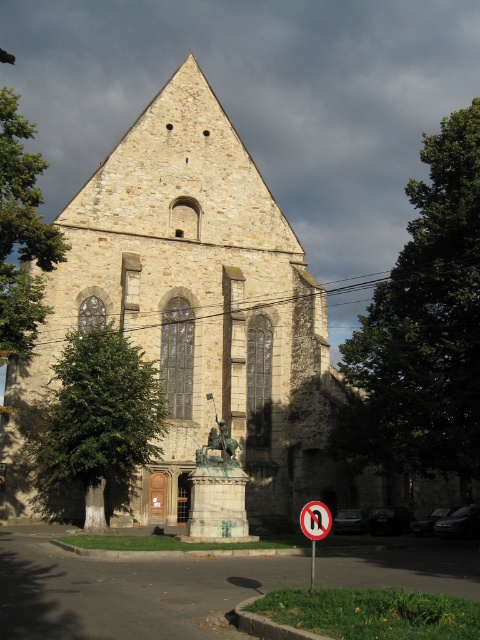
You are a tourist holding a map and looking at the stone church at center and the black plastic sign at center. According to the map, the sign should be placed below the church. Does the current arrangement match the map?

Yes, the stone church at center is located above the black plastic sign at center, which matches the map description.

You are standing in front of the historic stone building and want to take a photo. You notice two points marked as point 1 and point 2. Point 1 is at coordinate [304,508] and point 2 is at [317,532]. Which point is closer to your camera lens when taking the photo?

Point 1 at coordinate [304,508] is closer to the camera lens than point 2 at [317,532] because it is further to the camera according to the description.